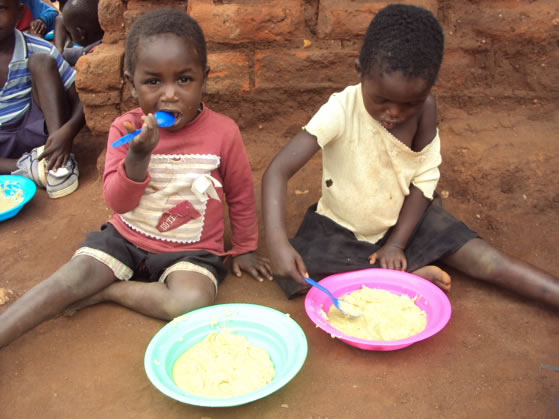
Image resolution: width=559 pixels, height=419 pixels. I want to click on handle of the spoon where you hold, so click(x=164, y=119), click(x=321, y=285), click(x=138, y=133).